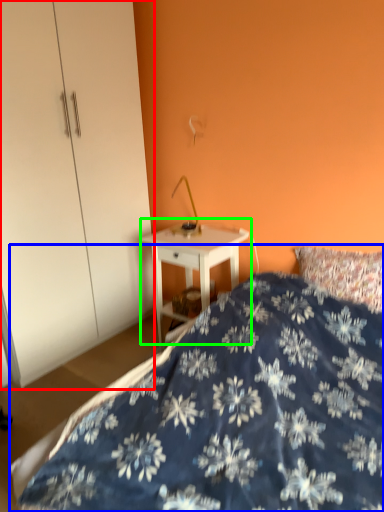
Question: Which object is the closest to the dresser (highlighted by a red box)? Choose among these: bed (highlighted by a blue box) or nightstand (highlighted by a green box).

Choices:
 (A) bed
 (B) nightstand

Answer: (B)